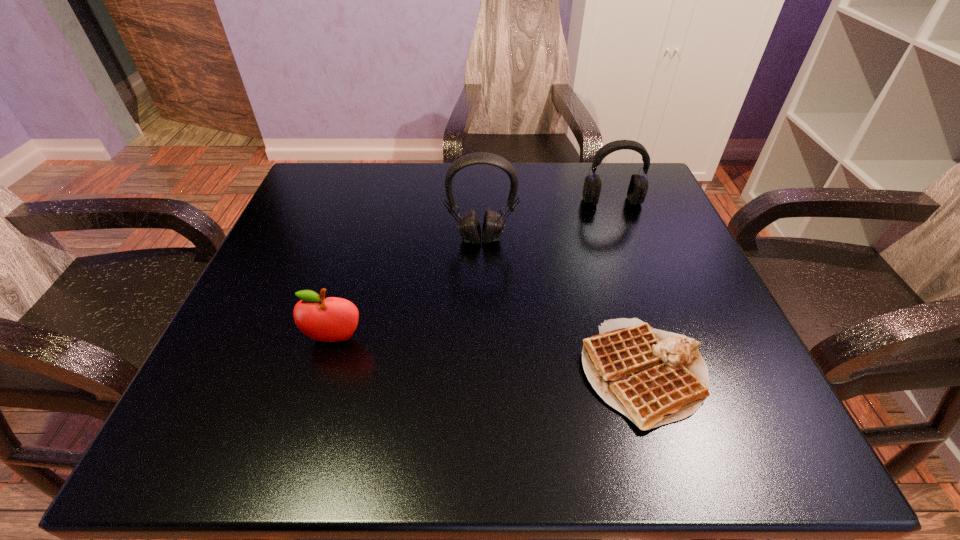
Identify the location of vacant point located between the apple and the left headset. The image size is (960, 540). (408, 289).

In order to click on vacant point located between the leftmost object and the third shortest object in this screenshot , I will do `click(473, 270)`.

At what (x,y) coordinates should I click in order to perform the action: click on unoccupied area between the waffle and the taller headset. Please return your answer as a coordinate pair (x, y). The height and width of the screenshot is (540, 960). Looking at the image, I should click on (563, 306).

This screenshot has height=540, width=960. Find the location of `the closest object to the right headset`. the closest object to the right headset is located at coordinates (468, 225).

Locate an element on the screen. object that is the second nearest to the second object from left to right is located at coordinates (654, 377).

Find the location of a particular element. vacant point that satisfies the following two spatial constraints: 1. on the front-facing side of the left headset; 2. on the right side of the waffle is located at coordinates (482, 373).

You are a GUI agent. You are given a task and a screenshot of the screen. Output one action in this format:
    pyautogui.click(x=<x>, y=<y>)
    Task: Click on the blank space that satisfies the following two spatial constraints: 1. on the front-facing side of the third object from right to left; 2. on the right side of the waffle
    
    Given the screenshot: What is the action you would take?
    pyautogui.click(x=482, y=373)

At what (x,y) coordinates should I click in order to perform the action: click on free space that satisfies the following two spatial constraints: 1. on the front-facing side of the shortest object; 2. on the right side of the second farthest object. Please return your answer as a coordinate pair (x, y). Looking at the image, I should click on (482, 373).

The width and height of the screenshot is (960, 540). Find the location of `vacant space that satisfies the following two spatial constraints: 1. on the front-facing side of the nearer headset; 2. on the right side of the shortest object`. vacant space that satisfies the following two spatial constraints: 1. on the front-facing side of the nearer headset; 2. on the right side of the shortest object is located at coordinates (482, 373).